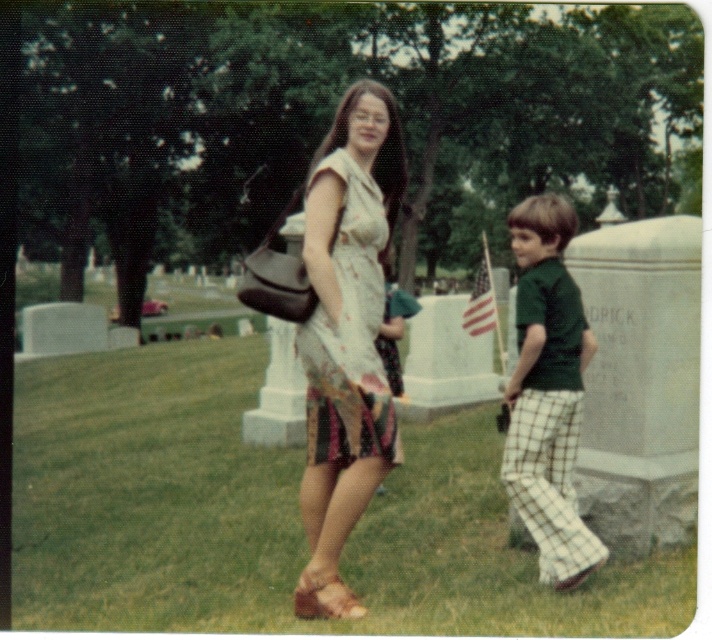
You are a photographer trying to capture the scene with a camera. You notice the green grass at center and the green textured shirt at right. Which object would occupy more space in your photo?

The green grass at center occupies more space in the photo because it is larger in size than the green textured shirt at right.

You are a fashion designer observing the matte floral dress at center and the leather sandal at lower center. Which item has a smaller width?

The matte floral dress at center has a smaller width than the leather sandal at lower center according to the description.

You are planning to place a small flower pot between the green grass at center and the leather sandal at lower center. Considering their widths, which object should the flower pot be closer to?

The green grass at center is wider than the leather sandal at lower center, so the flower pot should be placed closer to the leather sandal at lower center to ensure it fits within the available space.